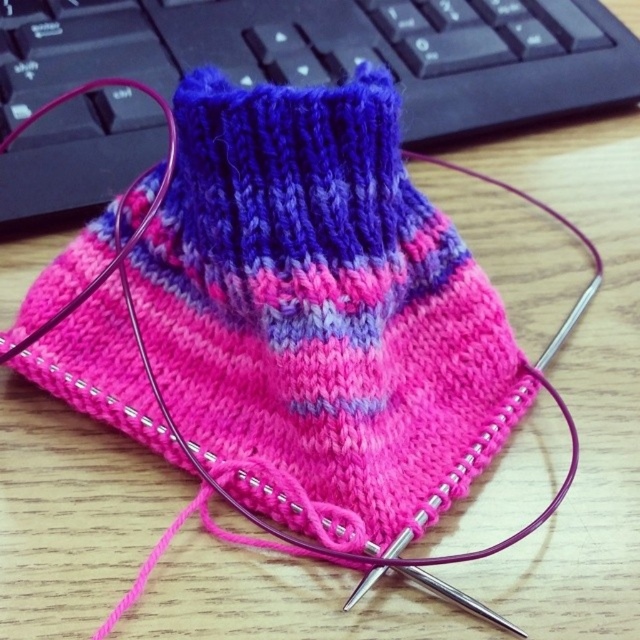
Is pink yarn knit at center to the right of matte black keyboard at upper center from the viewer's perspective?

No, pink yarn knit at center is not to the right of matte black keyboard at upper center.

Which is above, pink yarn knit at center or matte black keyboard at upper center?

matte black keyboard at upper center is above.

The height and width of the screenshot is (640, 640). Find the location of `pink yarn knit at center`. pink yarn knit at center is located at coordinates (321, 298).